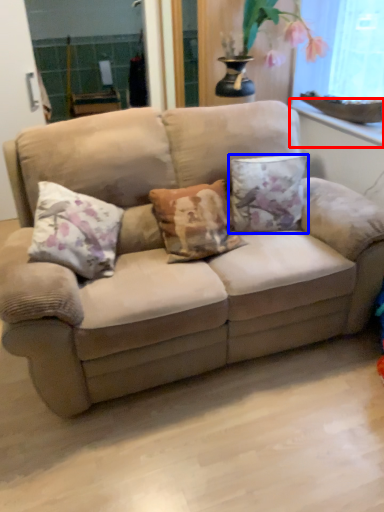
Question: Among these objects, which one is farthest to the camera, window sill (highlighted by a red box) or pillow (highlighted by a blue box)?

Choices:
 (A) window sill
 (B) pillow

Answer: (A)